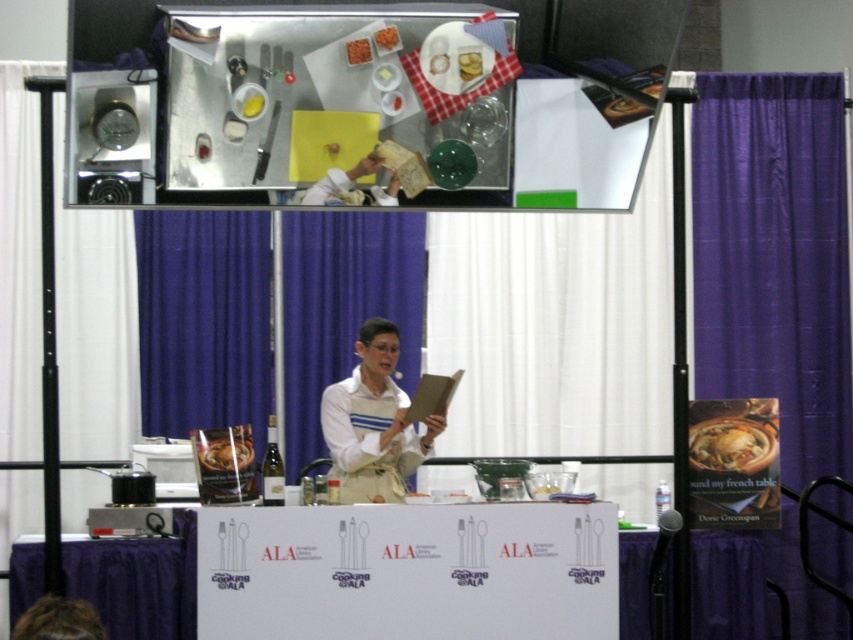
Can you confirm if white fabric apron at center is positioned to the left of orange shredded vegetable at center?

In fact, white fabric apron at center is to the right of orange shredded vegetable at center.

Which is behind, point (364, 362) or point (366, 38)?

Positioned behind is point (364, 362).

The height and width of the screenshot is (640, 853). What are the coordinates of `white fabric apron at center` in the screenshot? It's located at (373, 422).

Consider the image. Between white fabric curtain at upper center and smooth chocolate bar at center, which one appears on the right side from the viewer's perspective?

white fabric curtain at upper center

Can you confirm if white fabric curtain at upper center is positioned above smooth chocolate bar at center?

Yes.

Who is more forward, (610, 330) or (248, 445)?

Positioned in front is point (248, 445).

You are a GUI agent. You are given a task and a screenshot of the screen. Output one action in this format:
    pyautogui.click(x=<x>, y=<y>)
    Task: Click on the white fabric curtain at upper center
    
    Given the screenshot: What is the action you would take?
    pyautogui.click(x=556, y=324)

Does white fabric curtain at upper center have a lesser width compared to white fabric apron at center?

No.

Is point (480, 364) in front of point (392, 412)?

That is False.

In order to click on white fabric curtain at upper center in this screenshot , I will do [556, 324].

Find the location of a particular element. The width and height of the screenshot is (853, 640). white fabric curtain at upper center is located at coordinates (556, 324).